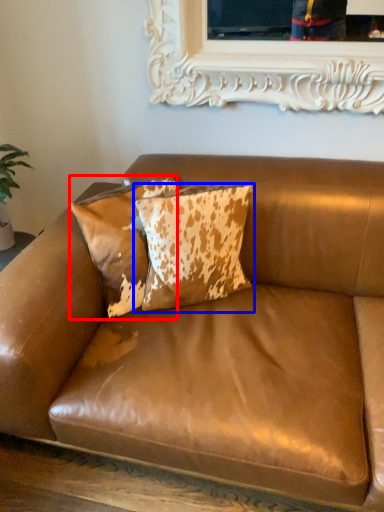
Question: Which of the following is the closest to the observer, pillow (highlighted by a red box) or pillow (highlighted by a blue box)?

Choices:
 (A) pillow
 (B) pillow

Answer: (B)